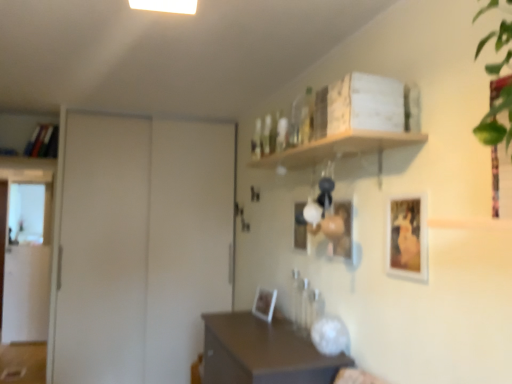
Question: Is white matte door at left taller than matte wooden picture frame at center, which is the 3th picture frame in left-to-right order?

Choices:
 (A) yes
 (B) no

Answer: (A)

Question: Is white matte door at left behind matte wooden picture frame at center, the 2th picture frame in the front-to-back sequence?

Choices:
 (A) no
 (B) yes

Answer: (B)

Question: Is matte wooden picture frame at center, which is counted as the 3th picture frame, starting from the back, completely or partially inside white matte door at left?

Choices:
 (A) no
 (B) yes

Answer: (A)

Question: Is white matte door at left oriented away from matte wooden picture frame at center, which is counted as the 3th picture frame, starting from the back?

Choices:
 (A) no
 (B) yes

Answer: (A)

Question: Is white matte door at left at the left side of matte wooden picture frame at center, which appears as the second picture frame when viewed from the right?

Choices:
 (A) yes
 (B) no

Answer: (A)

Question: Relative to matte white picture frame at center, the 1th picture frame from the back, is white matte door at left in front or behind?

Choices:
 (A) behind
 (B) front

Answer: (A)

Question: Is white matte door at left spatially inside matte white picture frame at center, which ranks as the fourth picture frame in front-to-back order, or outside of it?

Choices:
 (A) outside
 (B) inside

Answer: (A)

Question: From their relative heights in the image, would you say white matte door at left is taller or shorter than matte white picture frame at center, the 1th picture frame from the back?

Choices:
 (A) short
 (B) tall

Answer: (B)

Question: Visually, is white matte door at left positioned to the left or to the right of matte white picture frame at center, the first picture frame when ordered from left to right?

Choices:
 (A) right
 (B) left

Answer: (B)

Question: Based on their sizes in the image, would you say matte white picture frame at center, the 1th picture frame from the back, is bigger or smaller than white matte door at left?

Choices:
 (A) big
 (B) small

Answer: (B)

Question: Is matte white picture frame at center, the first picture frame when ordered from left to right, inside the boundaries of white matte door at left, or outside?

Choices:
 (A) inside
 (B) outside

Answer: (B)

Question: From the image's perspective, is matte white picture frame at center, the 4th picture frame from the right, positioned above or below white matte door at left?

Choices:
 (A) below
 (B) above

Answer: (A)

Question: Considering the positions of point [263, 304] and point [111, 329], is point [263, 304] closer or farther from the camera than point [111, 329]?

Choices:
 (A) farther
 (B) closer

Answer: (B)

Question: Is matte white picture frame at center, the 1th picture frame from the back, situated inside translucent glass bottle at upper center or outside?

Choices:
 (A) outside
 (B) inside

Answer: (A)

Question: From a real-world perspective, is matte white picture frame at center, the 4th picture frame from the right, above or below translucent glass bottle at upper center?

Choices:
 (A) below
 (B) above

Answer: (A)